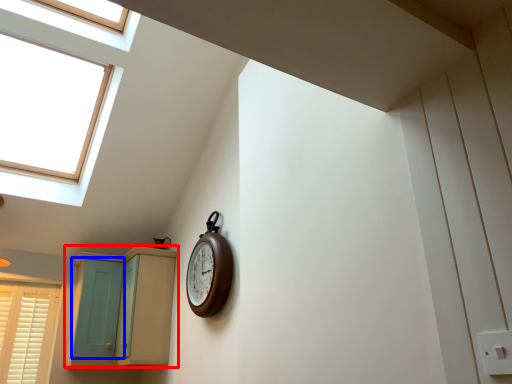
Question: Which point is further to the camera, cabinetry (highlighted by a red box) or screen door (highlighted by a blue box)?

Choices:
 (A) cabinetry
 (B) screen door

Answer: (B)